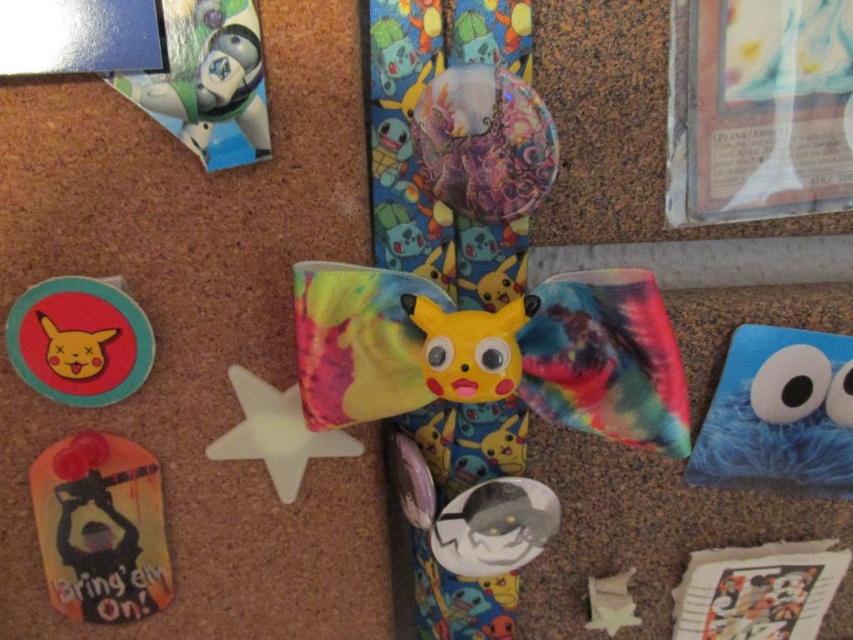
Is the position of blue fuzzy cookie monster at lower right less distant than that of white plastic star at center?

No, it is behind white plastic star at center.

In the scene shown: Can you confirm if blue fuzzy cookie monster at lower right is bigger than white plastic star at center?

Yes.

Is point (838, 436) positioned after point (225, 445)?

Yes, point (838, 436) is farther from viewer.

The image size is (853, 640). I want to click on blue fuzzy cookie monster at lower right, so click(x=779, y=413).

Does matte red circle at upper left have a lesser width compared to white plastic star at center?

Correct, matte red circle at upper left's width is less than white plastic star at center's.

Can you confirm if matte red circle at upper left is positioned to the left of white plastic star at center?

Correct, you'll find matte red circle at upper left to the left of white plastic star at center.

Is point (47, 326) less distant than point (293, 470)?

Yes, it is.

This screenshot has width=853, height=640. In order to click on matte red circle at upper left in this screenshot , I will do `click(79, 340)`.

Is point (666, 429) farther from viewer compared to point (122, 500)?

No.

Who is more distant from viewer, (393, 332) or (131, 515)?

Point (131, 515)

What do you see at coordinates (490, 353) in the screenshot? Image resolution: width=853 pixels, height=640 pixels. I see `tie-dye fabric bow at center` at bounding box center [490, 353].

You are a GUI agent. You are given a task and a screenshot of the screen. Output one action in this format:
    pyautogui.click(x=<x>, y=<y>)
    Task: Click on the tie-dye fabric bow at center
    This screenshot has width=853, height=640.
    Given the screenshot: What is the action you would take?
    pyautogui.click(x=490, y=353)